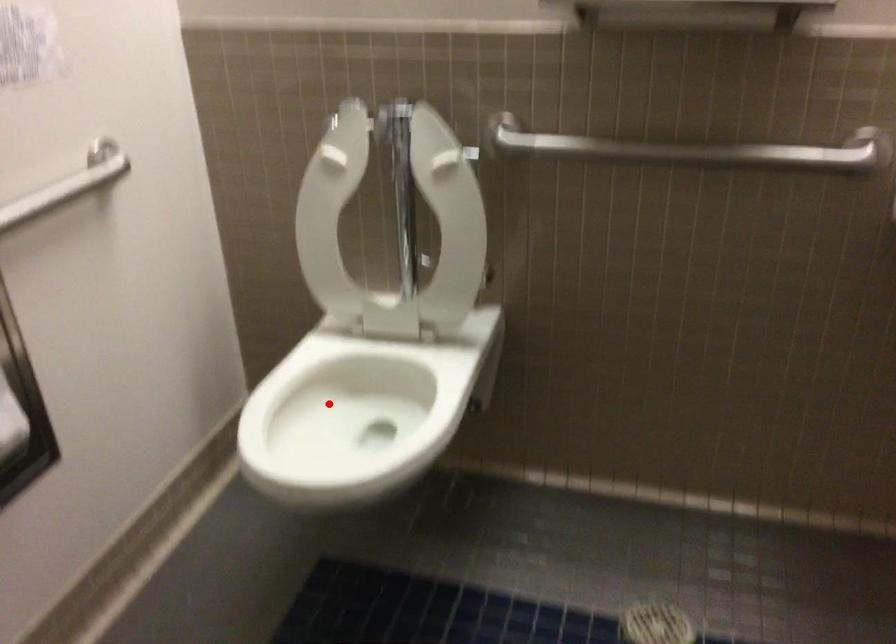
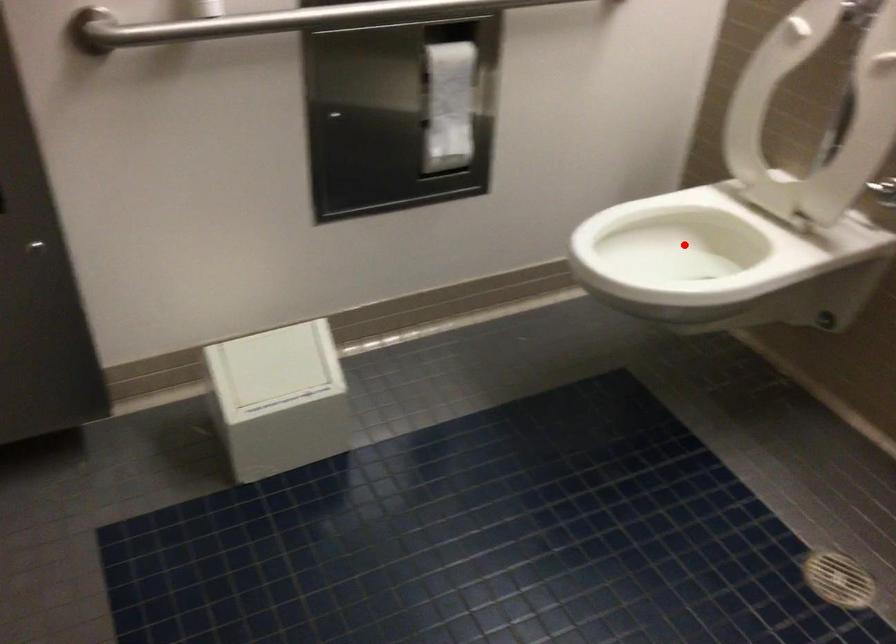
I am providing you with two images of the same scene from different viewpoints. A red point is marked on the first image and another point is marked on the second image. Does the point marked in image1 correspond to the same location as the one in image2?

Yes